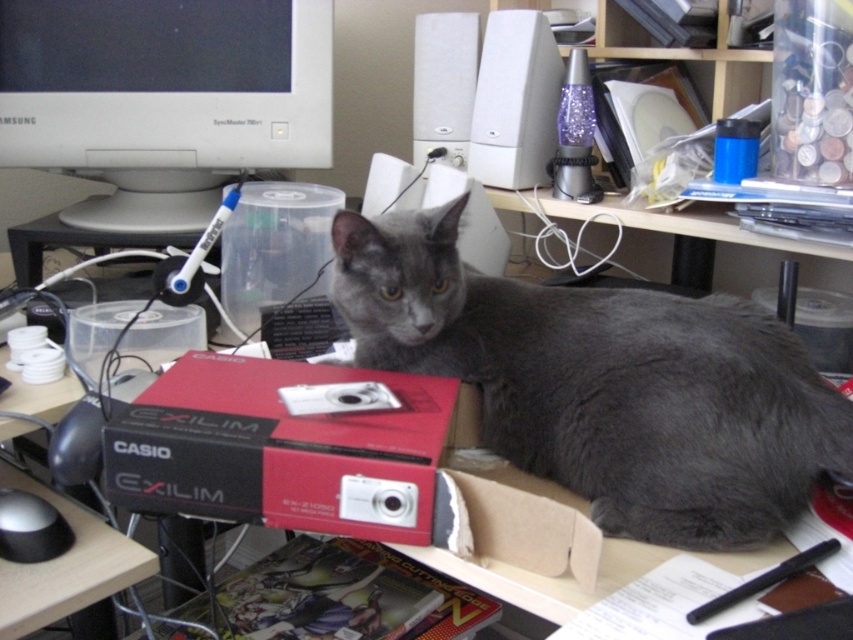
You are trying to reach the cardboard at lower center to pick it up, but there is a gray fur cat at center in the way. Can you easily move around the cat to get to the cardboard without disturbing it?

The gray fur cat at center is further to the viewer than the cardboard at lower center, so you would need to move around the cat to access the cardboard behind it. Since the cat is closer to you, you can go around it carefully to reach the cardboard without disturbing it.

You are a photographer trying to capture a closeup of the black matte mouse at lower left without disturbing the gray fur cat at center. What is the minimum distance you need to maintain between the camera and the mouse to ensure the cat stays undisturbed?

The gray fur cat at center is 20.78 inches away from the black matte mouse at lower left. To avoid disturbing the cat, the photographer should maintain a distance of at least 20.78 inches between the camera and the mouse.